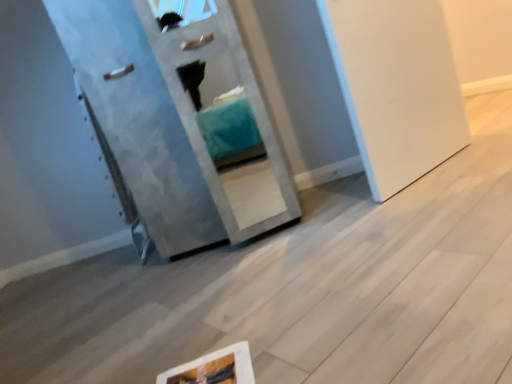
Identify the location of free space that is to the left of matte gray cabinet at center. [x=111, y=291].